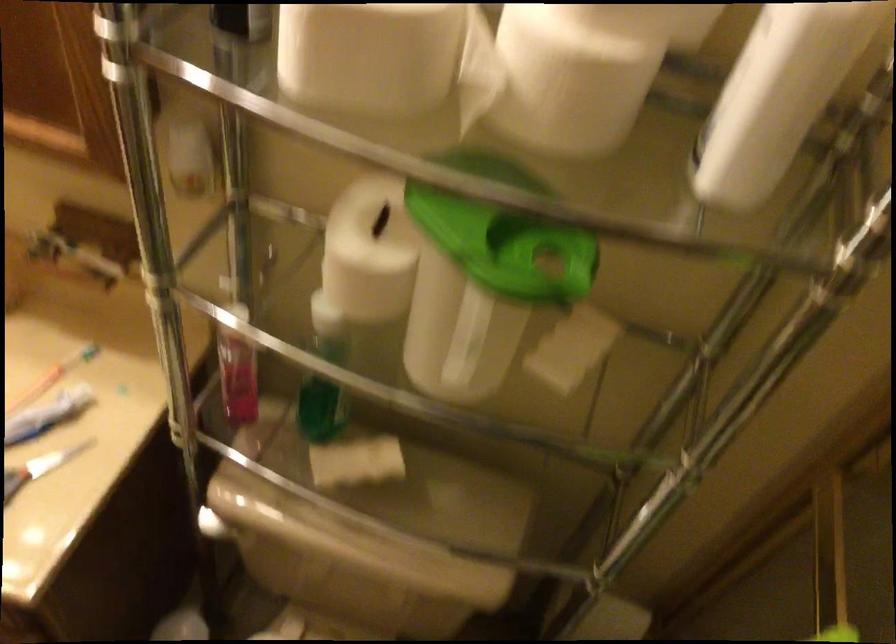
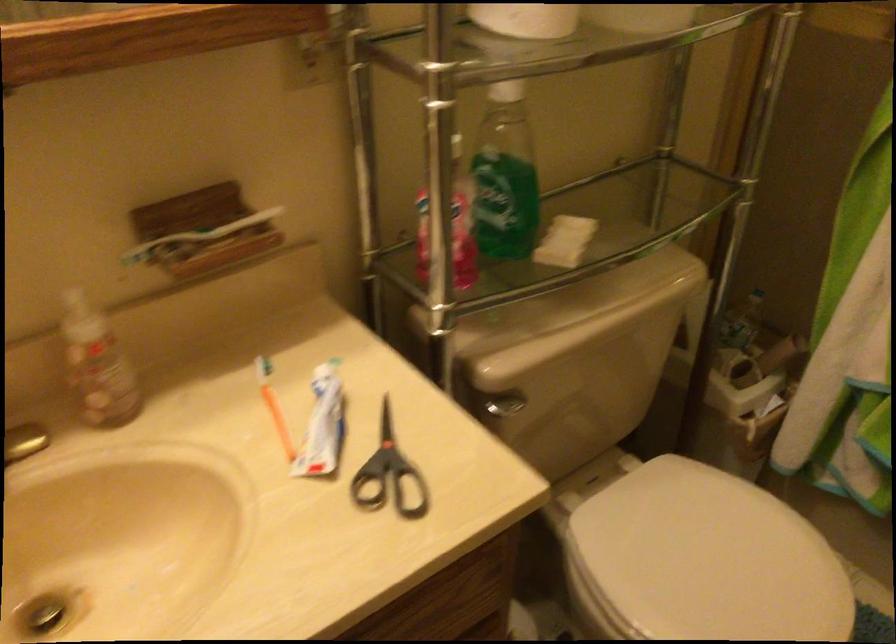
Find the pixel in the second image that matches the point at 92,242 in the first image.

(212, 230)